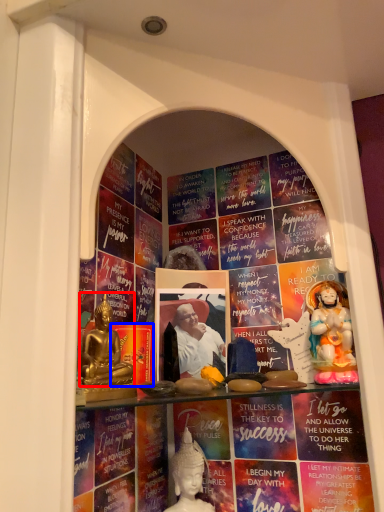
Question: Which point is closer to the camera, person (highlighted by a red box) or paperback book (highlighted by a blue box)?

Choices:
 (A) person
 (B) paperback book

Answer: (A)